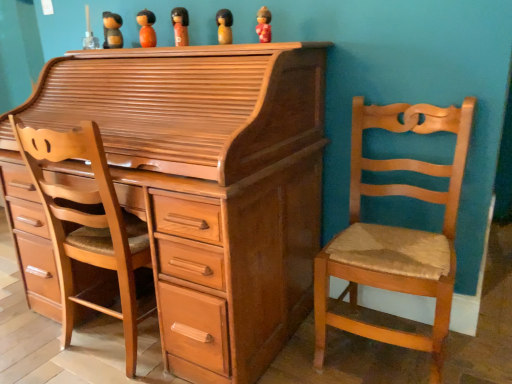
Identify the location of unoccupied area in front of matte red figurine at upper center, acting as the 1th toy starting from the right. The image size is (512, 384). (268, 47).